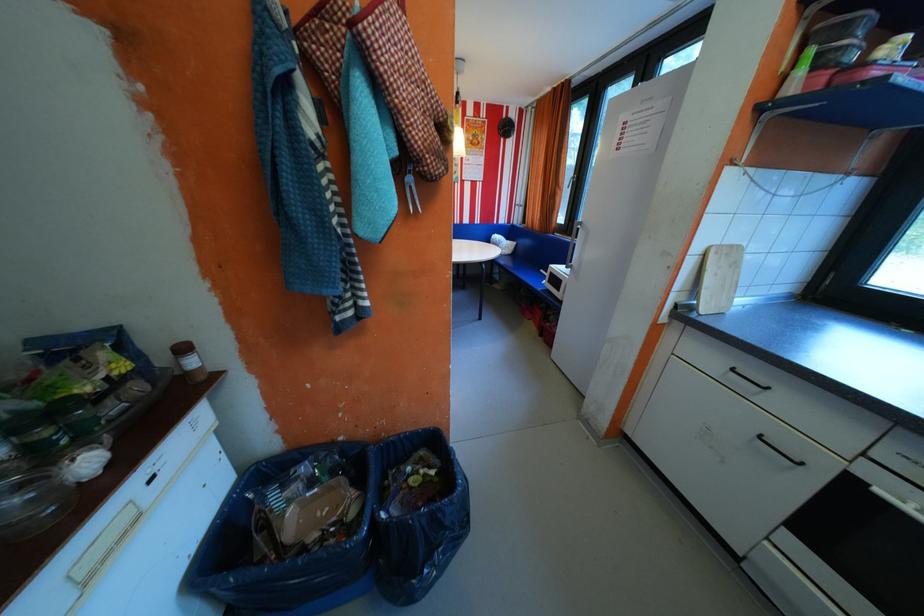
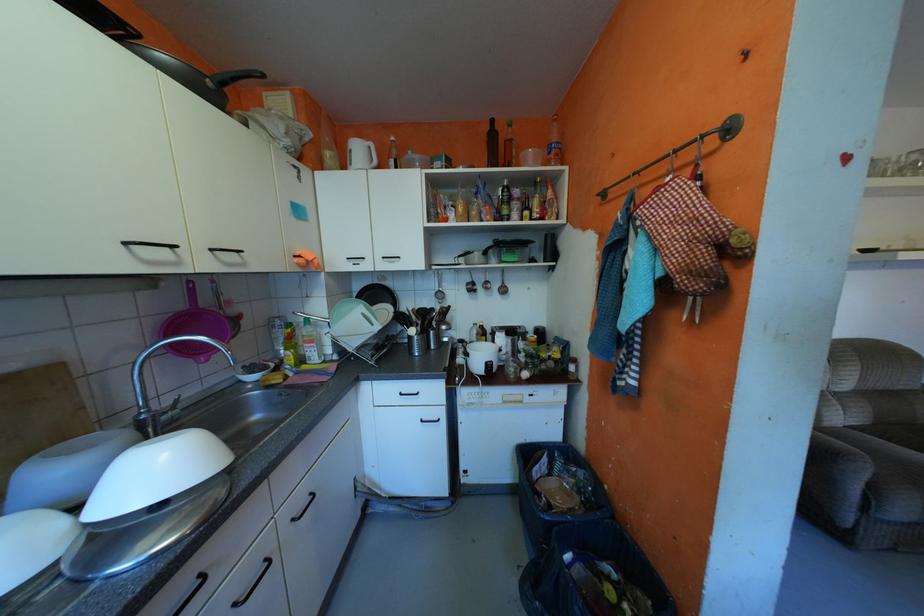
Question: The camera is either moving clockwise (left) or counter-clockwise (right) around the object. The first image is from the beginning of the video and the second image is from the end. Is the camera moving left or right when shooting the video?

Choices:
 (A) Left
 (B) Right

Answer: (B)